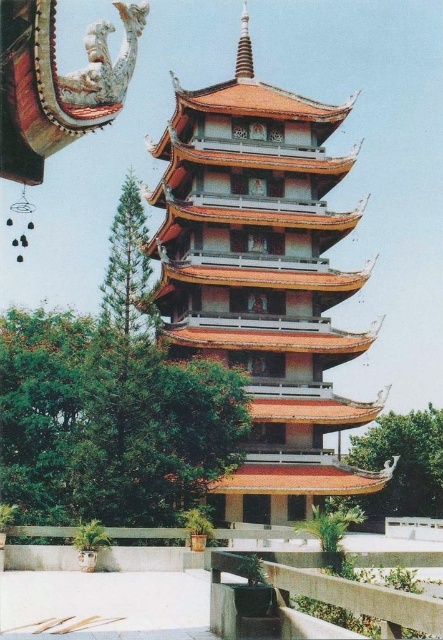
You are standing at the entrance of the pagoda and want to reach the point marked as point [248,202]. Considering the pagoda has a 200 feet long pathway leading to its base, can you walk straight from the entrance to this point without any obstacles?

The distance between point [248,202] and the viewer is 222.69 feet. Since the pagoda has a 200 feet long pathway, the point is beyond the pathway. Therefore, you cannot walk straight to it without obstacles.